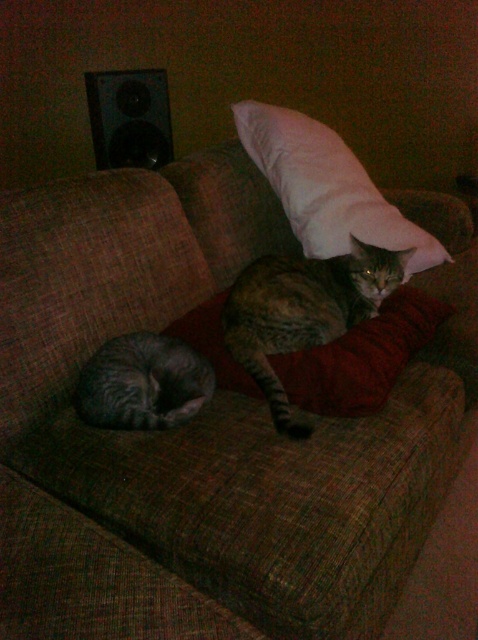
Does tabby fur cat at center appear under white soft pillow at upper center?

Correct, tabby fur cat at center is located below white soft pillow at upper center.

Between point (234, 314) and point (325, 196), which one is positioned in front?

Positioned in front is point (234, 314).

Locate an element on the screen. This screenshot has width=478, height=640. tabby fur cat at center is located at coordinates (303, 310).

Is tabby fur cat at center below gray striped cat at lower left?

Actually, tabby fur cat at center is above gray striped cat at lower left.

Between point (282, 346) and point (139, 356), which one is positioned in front?

Point (139, 356) is in front.

Is point (274, 353) more distant than point (129, 397)?

Yes, it is behind point (129, 397).

Identify the location of tabby fur cat at center. (303, 310).

Which of these two, white soft pillow at upper center or black plastic speaker at upper left, stands shorter?

Standing shorter between the two is black plastic speaker at upper left.

Is white soft pillow at upper center to the left of black plastic speaker at upper left from the viewer's perspective?

No, white soft pillow at upper center is not to the left of black plastic speaker at upper left.

Where is `white soft pillow at upper center`? This screenshot has height=640, width=478. white soft pillow at upper center is located at coordinates (326, 188).

At what (x,y) coordinates should I click in order to perform the action: click on white soft pillow at upper center. Please return your answer as a coordinate pair (x, y). The height and width of the screenshot is (640, 478). Looking at the image, I should click on (326, 188).